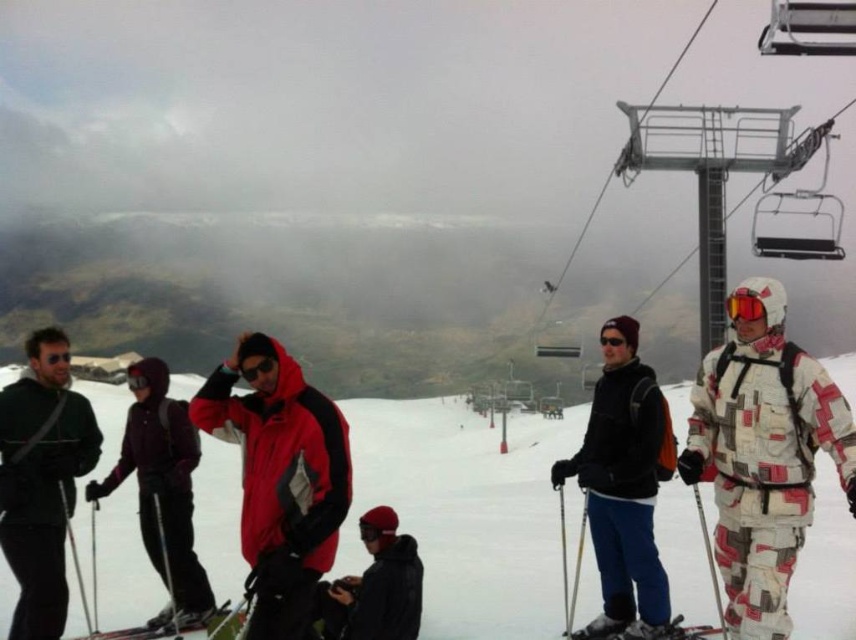
You are a photographer wanting to capture a photo of the white matte snow at center and the matte purple ski suit at left. Based on their positions, which object is located lower in the image?

The white matte snow at center is positioned under the matte purple ski suit at left, so the snow is lower in the image.

You are standing at the ski resort and want to take a photo of the matte black jacket at left and the matte purple ski suit at left. Which one should you focus on first to ensure both are in sharp focus?

You should focus on the matte black jacket at left first since it is closer to the viewer than the matte purple ski suit at left. By focusing on the closer object, the depth of field may include both in sharp focus.